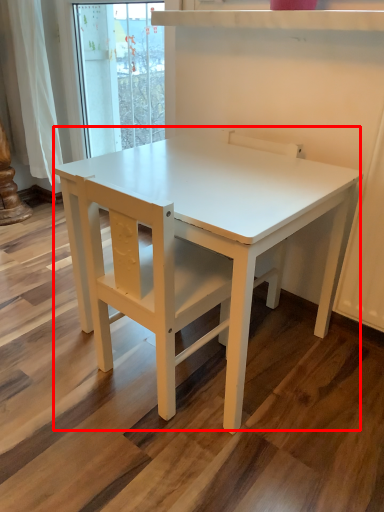
Question: Observing the image, what is the correct spatial positioning of table (annotated by the red box) in reference to chair?

Choices:
 (A) left
 (B) right

Answer: (A)